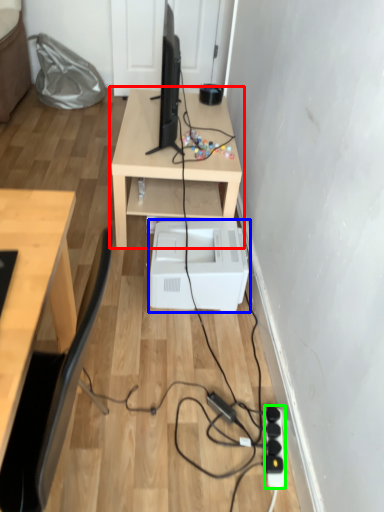
Question: Which object is positioned farthest from table (highlighted by a red box)? Select from printer (highlighted by a blue box) and extension cord (highlighted by a green box).

Choices:
 (A) printer
 (B) extension cord

Answer: (B)